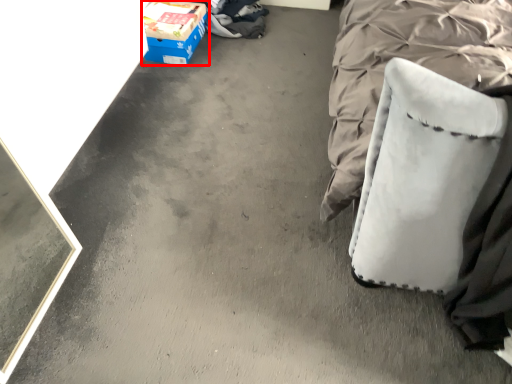
Question: From the image's perspective, considering the relative positions of box (annotated by the red box) and swivel chair in the image provided, where is box (annotated by the red box) located with respect to the staircase?

Choices:
 (A) above
 (B) below

Answer: (A)